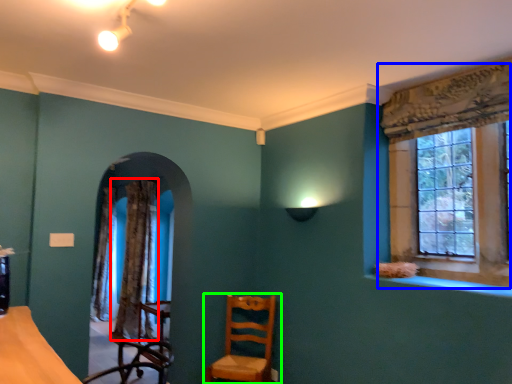
Question: Considering the real-world distances, which object is closest to curtain (highlighted by a red box)? window (highlighted by a blue box) or chair (highlighted by a green box).

Choices:
 (A) window
 (B) chair

Answer: (B)